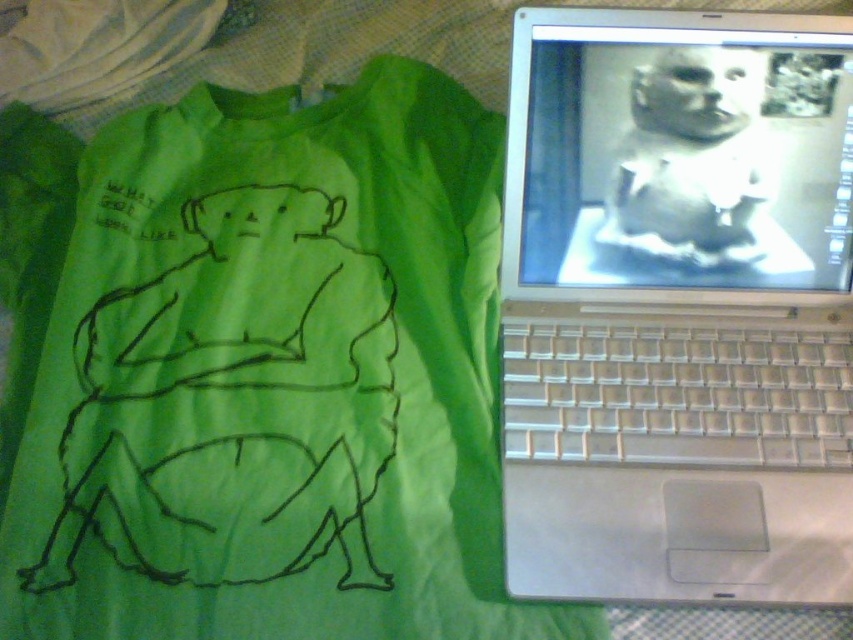
Is green fabric t-shirt at upper left smaller than white matte baby at upper right?

Incorrect, green fabric t-shirt at upper left is not smaller in size than white matte baby at upper right.

Is point (120, 196) in front of point (635, 176)?

No, (120, 196) is further to viewer.

Measure the distance between point (367,77) and camera.

Point (367,77) and camera are 31.87 inches apart.

The width and height of the screenshot is (853, 640). Find the location of `green fabric t-shirt at upper left`. green fabric t-shirt at upper left is located at coordinates (258, 371).

Is green fabric t-shirt at upper left to the left of silver metallic laptop at upper right from the viewer's perspective?

Indeed, green fabric t-shirt at upper left is positioned on the left side of silver metallic laptop at upper right.

Which is below, green fabric t-shirt at upper left or silver metallic laptop at upper right?

green fabric t-shirt at upper left is below.

Describe the element at coordinates (258, 371) in the screenshot. I see `green fabric t-shirt at upper left` at that location.

Where is `green fabric t-shirt at upper left`? green fabric t-shirt at upper left is located at coordinates (258, 371).

Is silver metallic laptop at upper right smaller than white matte baby at upper right?

No, silver metallic laptop at upper right is not smaller than white matte baby at upper right.

Who is higher up, silver metallic laptop at upper right or white matte baby at upper right?

Positioned higher is white matte baby at upper right.

Is point (560, 36) positioned behind point (686, 51)?

No, (560, 36) is in front of (686, 51).

The image size is (853, 640). I want to click on silver metallic laptop at upper right, so click(677, 307).